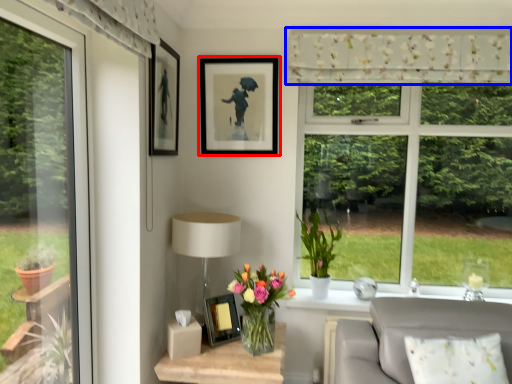
Question: Which point is further to the camera, picture frame (highlighted by a red box) or curtain (highlighted by a blue box)?

Choices:
 (A) picture frame
 (B) curtain

Answer: (A)